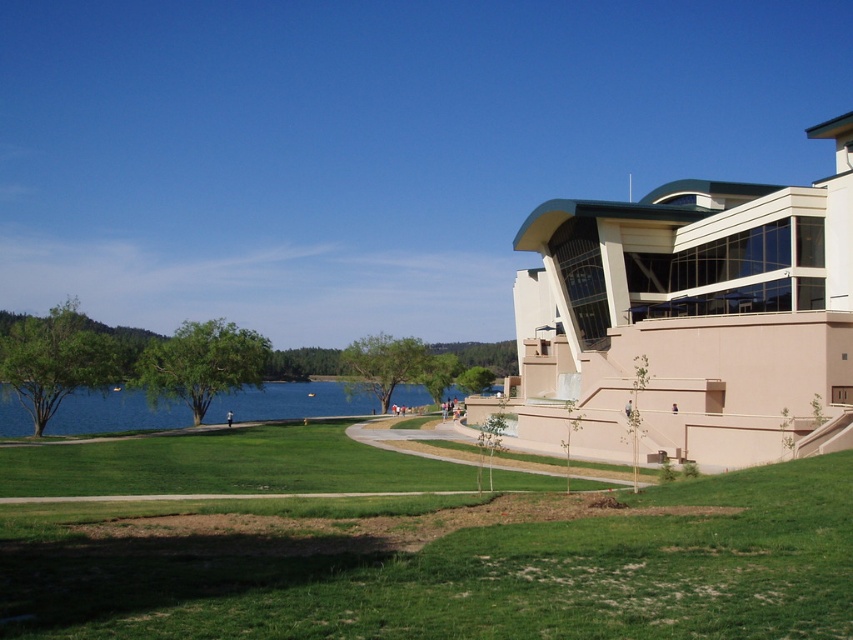
Question: Does green grass at lower center have a greater width compared to blue water at center?

Choices:
 (A) no
 (B) yes

Answer: (A)

Question: Does green grass at lower center lie in front of blue water at center?

Choices:
 (A) yes
 (B) no

Answer: (A)

Question: Which of the following is the farthest from the observer?

Choices:
 (A) (160, 420)
 (B) (85, 477)

Answer: (A)

Question: Which object is farther from the camera taking this photo?

Choices:
 (A) green grass at lower center
 (B) blue water at center

Answer: (B)

Question: Can you confirm if green grass at lower center is bigger than blue water at center?

Choices:
 (A) no
 (B) yes

Answer: (A)